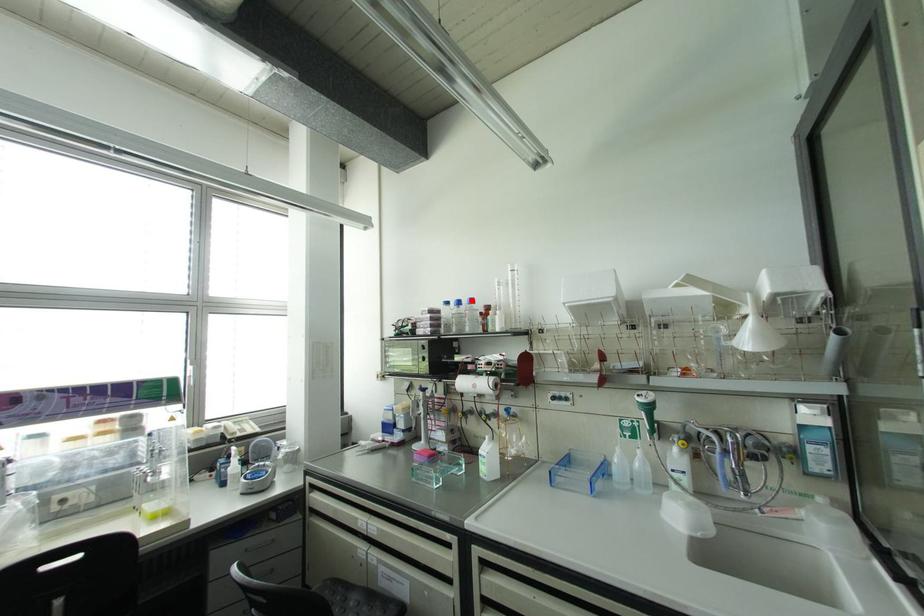
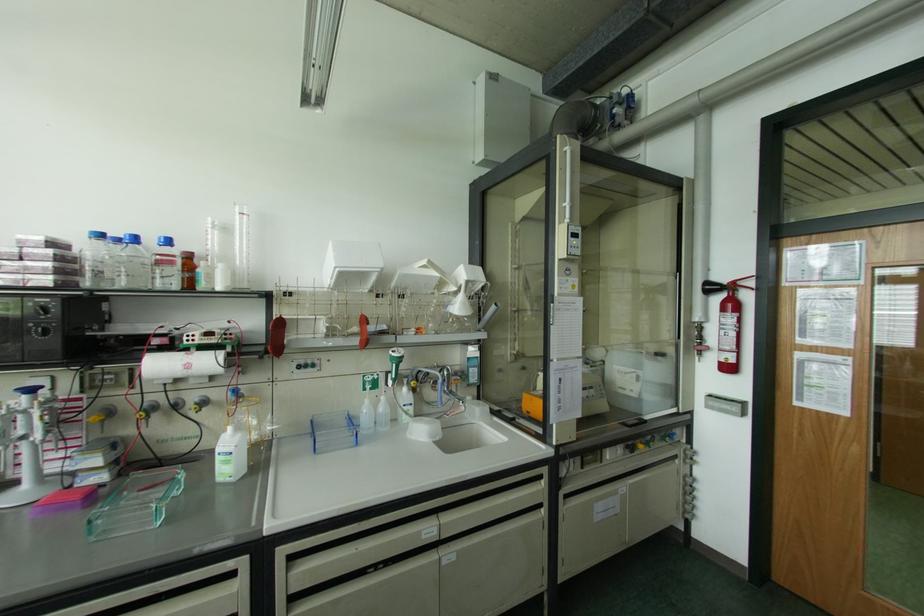
Find the pixel in the second image that matches the highlighted location in the first image.

(167, 241)